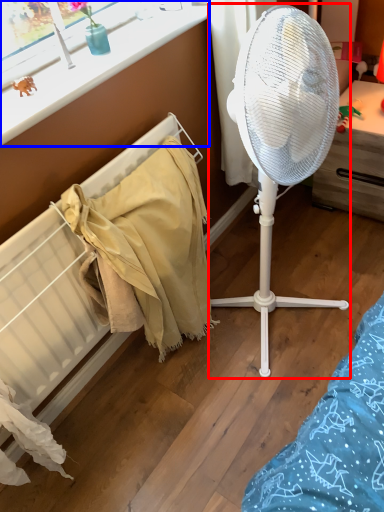
Question: Which object is closer to the camera taking this photo, mechanical fan (highlighted by a red box) or window frame (highlighted by a blue box)?

Choices:
 (A) mechanical fan
 (B) window frame

Answer: (A)